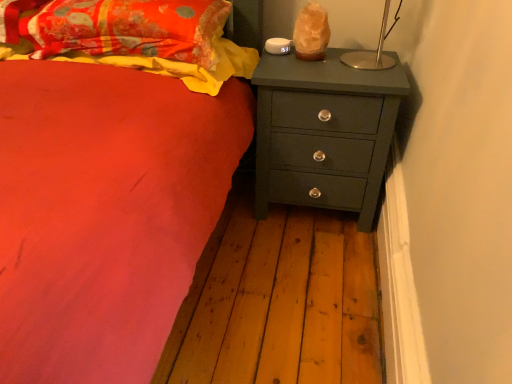
Question: From the image's perspective, is fluffy cotton blanket at upper left positioned above or below floral fabric pillow at upper left?

Choices:
 (A) above
 (B) below

Answer: (B)

Question: In the image, is fluffy cotton blanket at upper left positioned in front of or behind floral fabric pillow at upper left?

Choices:
 (A) behind
 (B) front

Answer: (A)

Question: Which object is positioned closest to the matte dark green chest of drawers at right?

Choices:
 (A) fluffy cotton blanket at upper left
 (B) floral fabric pillow at upper left

Answer: (A)

Question: Estimate the real-world distances between objects in this image. Which object is closer to the fluffy cotton blanket at upper left?

Choices:
 (A) matte dark green chest of drawers at right
 (B) floral fabric pillow at upper left

Answer: (B)